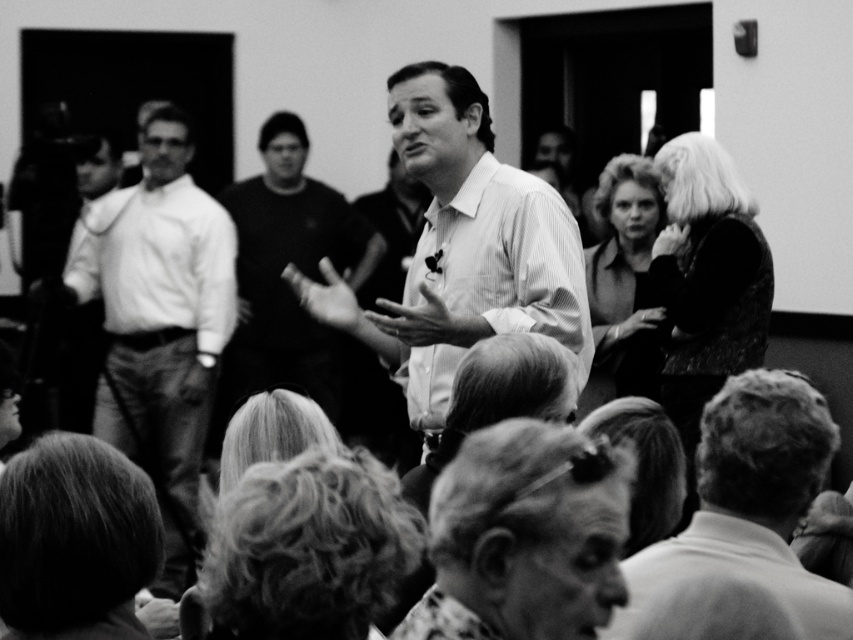
You are a photographer trying to capture a closeup of the speaker while also including the audience. You have two points marked in the image to focus on. The first point is at coordinates point [148,516], and the second is at point [593,294]. Which point should you focus on to ensure the speaker is in sharp focus?

Point [148,516] is closer to the camera than point [593,294], so focusing on point [148,516] will ensure the speaker is in sharp focus.

In the scene of a public speaking event, there are two central figures wearing a white striped shirt at center and a white shirt at center. Which one is located to the right of the other?

The white striped shirt at center is positioned on the right side of white shirt at center.

You are a photographer standing at the back of the room with a camera. You want to capture a closeup shot of the smooth hair at lower left. Given that your camera can focus on objects within 3 meters, will you be able to take the photo without moving closer?

The smooth hair at lower left and the camera are 2.85 meters apart, so yes, the photographer can take the photo without moving closer since the distance is within the camera focus range of 3 meters.